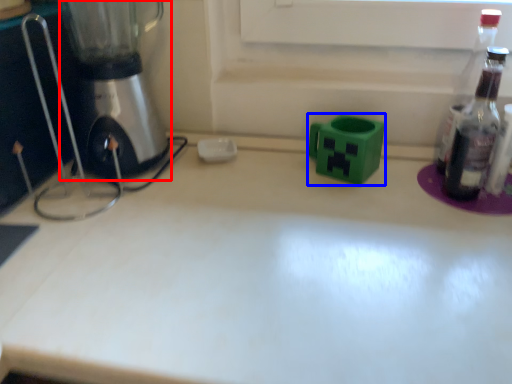
Question: Which point is further to the camera, mixer (highlighted by a red box) or appliance (highlighted by a blue box)?

Choices:
 (A) mixer
 (B) appliance

Answer: (B)